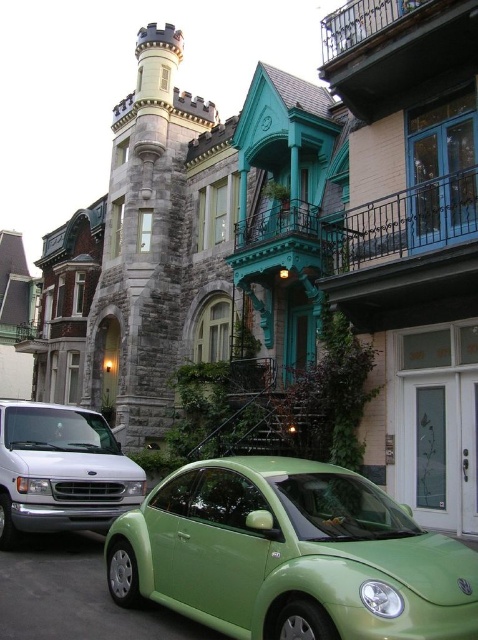
Is green matte car at lower center smaller than silver metallic van at lower left?

No, green matte car at lower center is not smaller than silver metallic van at lower left.

From the picture: Between green matte car at lower center and silver metallic van at lower left, which one appears on the left side from the viewer's perspective?

silver metallic van at lower left is more to the left.

Identify the location of green matte car at lower center. Image resolution: width=478 pixels, height=640 pixels. (291, 556).